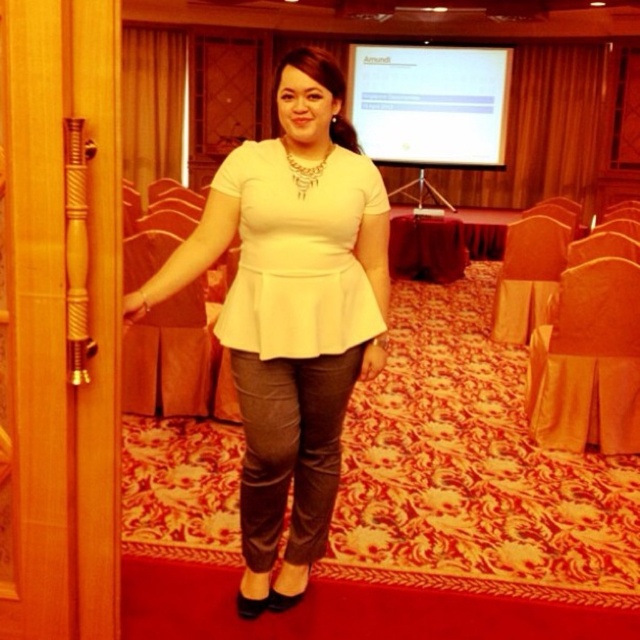
Question: Which object is closer to the camera taking this photo?

Choices:
 (A) matte white blouse at center
 (B) white matte peplum top at center

Answer: (A)

Question: In this image, where is matte white blouse at center located relative to white matte peplum top at center?

Choices:
 (A) left
 (B) right

Answer: (A)

Question: Can you confirm if matte white blouse at center is positioned below white matte peplum top at center?

Choices:
 (A) yes
 (B) no

Answer: (A)

Question: Does matte white blouse at center come behind white matte peplum top at center?

Choices:
 (A) yes
 (B) no

Answer: (B)

Question: Which object is farther from the camera taking this photo?

Choices:
 (A) matte white blouse at center
 (B) white matte peplum top at center

Answer: (B)

Question: Which point is closer to the camera?

Choices:
 (A) white matte peplum top at center
 (B) matte white blouse at center

Answer: (B)